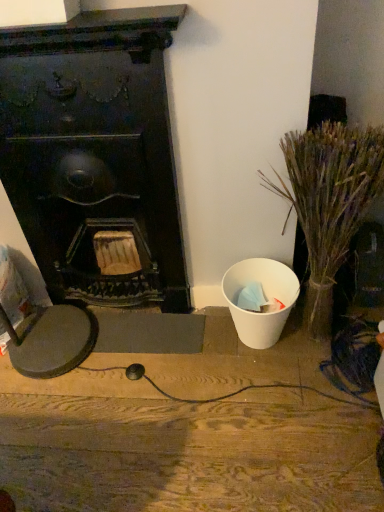
Question: From the image's perspective, is white matte trash can at right located above or below dry grass at right?

Choices:
 (A) below
 (B) above

Answer: (A)

Question: In terms of height, does white matte trash can at right look taller or shorter compared to dry grass at right?

Choices:
 (A) tall
 (B) short

Answer: (B)

Question: Considering the real-world distances, which object is closest to the dry grass at right?

Choices:
 (A) white matte trash can at right
 (B) black matte fireplace at left

Answer: (B)

Question: Which is farther from the dry grass at right?

Choices:
 (A) white matte trash can at right
 (B) black matte fireplace at left

Answer: (A)